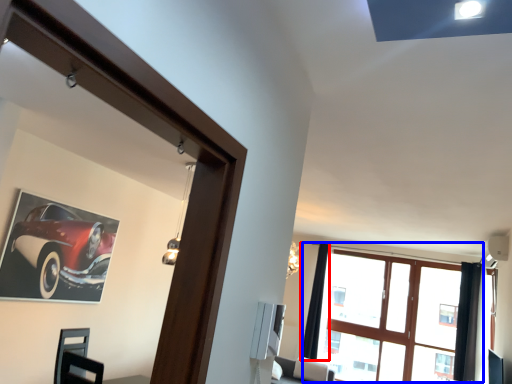
Question: Which object is closer to the camera taking this photo, curtain (highlighted by a red box) or window (highlighted by a blue box)?

Choices:
 (A) curtain
 (B) window

Answer: (B)